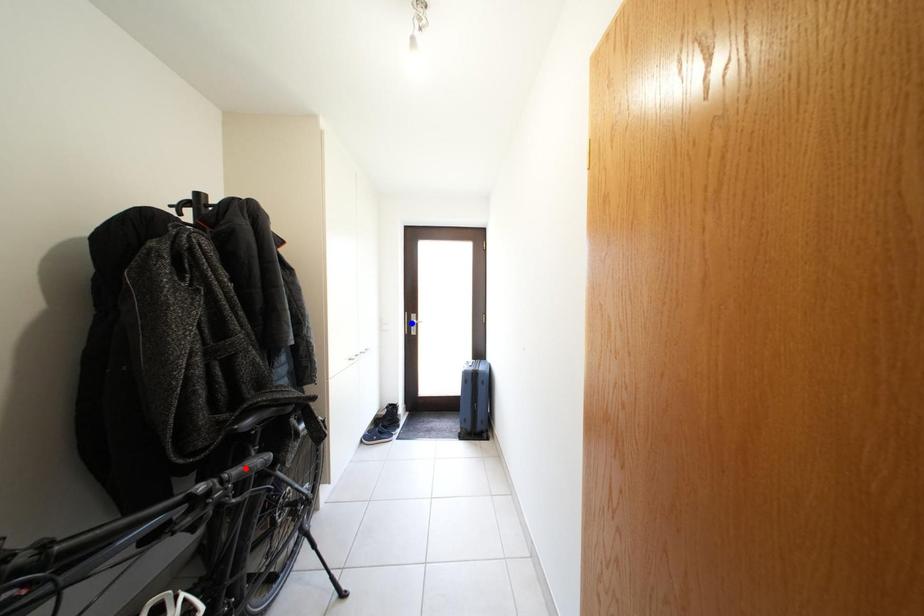
Question: In the image, two points are highlighted. Which point is nearer to the camera? Reply with the corresponding letter.

Choices:
 (A) blue point
 (B) red point

Answer: (B)